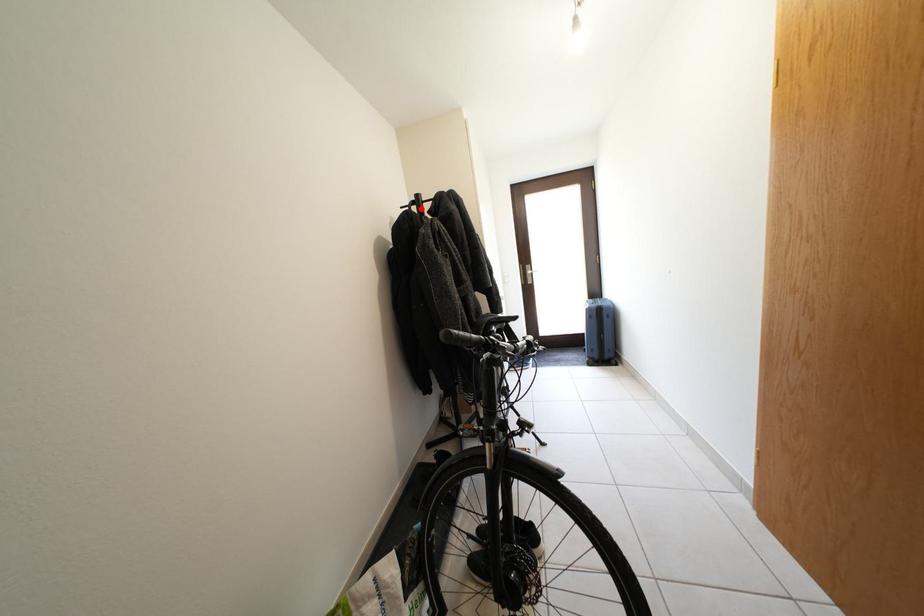
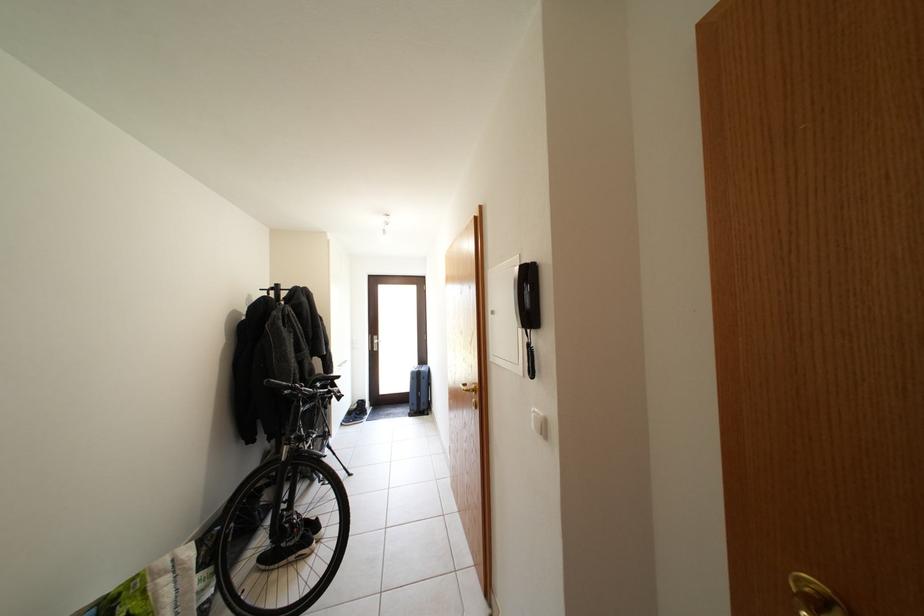
In the second image, find the point that corresponds to the highlighted location in the first image.

(281, 294)